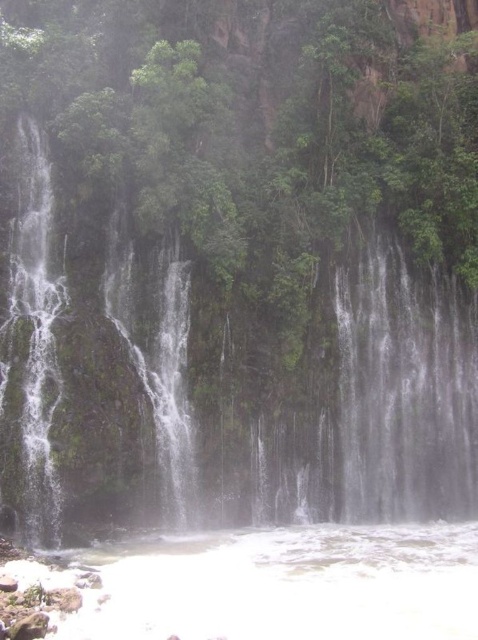
Is point (228, 401) behind point (339, 602)?

Yes.

You are a GUI agent. You are given a task and a screenshot of the screen. Output one action in this format:
    pyautogui.click(x=<x>, y=<y>)
    Task: Click on the white frothy water at center
    
    Given the screenshot: What is the action you would take?
    pyautogui.click(x=227, y=394)

The image size is (478, 640). Identify the location of white frothy water at center. (227, 394).

Image resolution: width=478 pixels, height=640 pixels. I want to click on white frothy water at center, so click(227, 394).